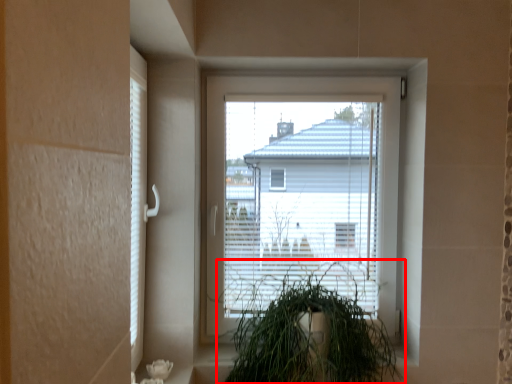
Question: From the image's perspective, what is the correct spatial positioning of houseplant (annotated by the red box) in reference to window?

Choices:
 (A) below
 (B) above

Answer: (A)